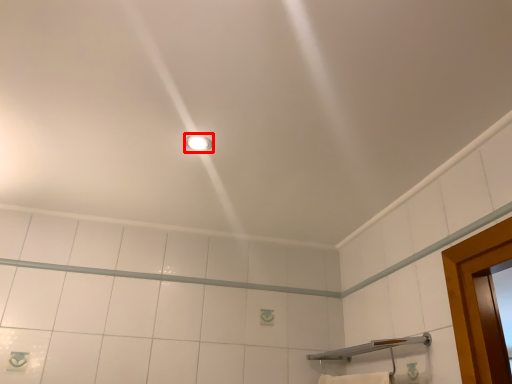
Question: Where is light fixture (annotated by the red box) located in relation to shower in the image?

Choices:
 (A) right
 (B) left

Answer: (B)